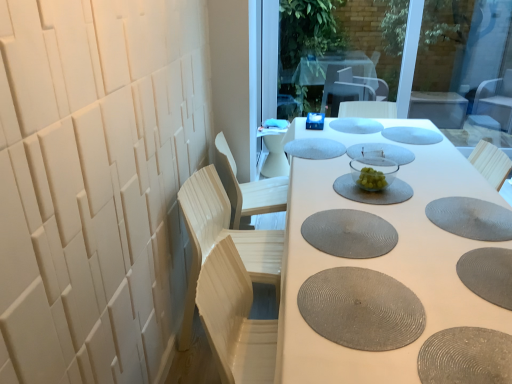
Where is `free location to the right of gray textured placemat at center, the ninth manhole cover when ordered from back to front`? The width and height of the screenshot is (512, 384). free location to the right of gray textured placemat at center, the ninth manhole cover when ordered from back to front is located at coordinates (448, 303).